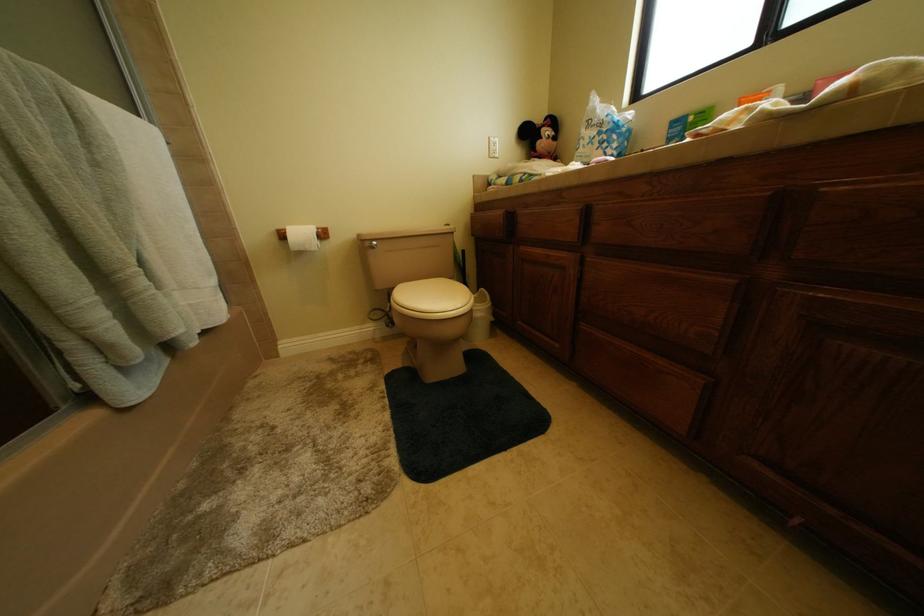
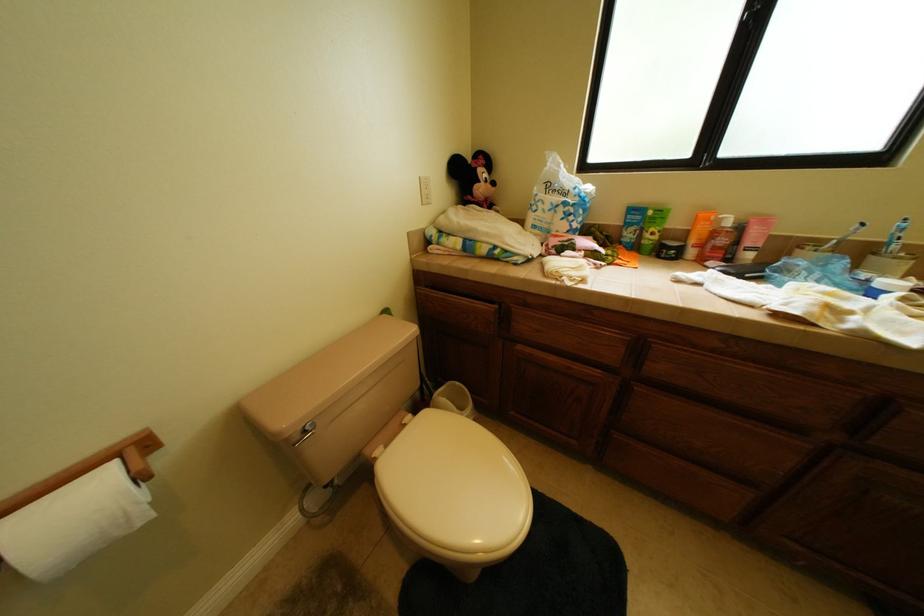
Question: The first image is from the beginning of the video and the second image is from the end. How did the camera likely rotate when shooting the video?

Choices:
 (A) Left
 (B) Right
 (C) Up
 (D) Down

Answer: (B)